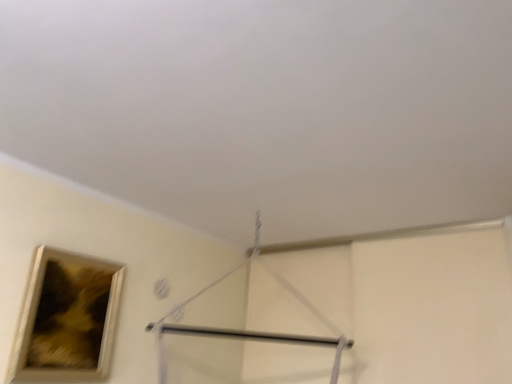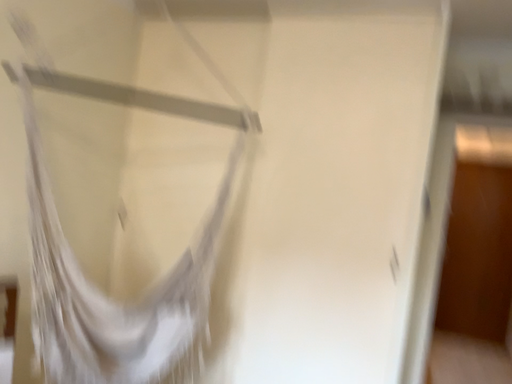
Question: How did the camera likely rotate when shooting the video?

Choices:
 (A) rotated right
 (B) rotated left

Answer: (A)